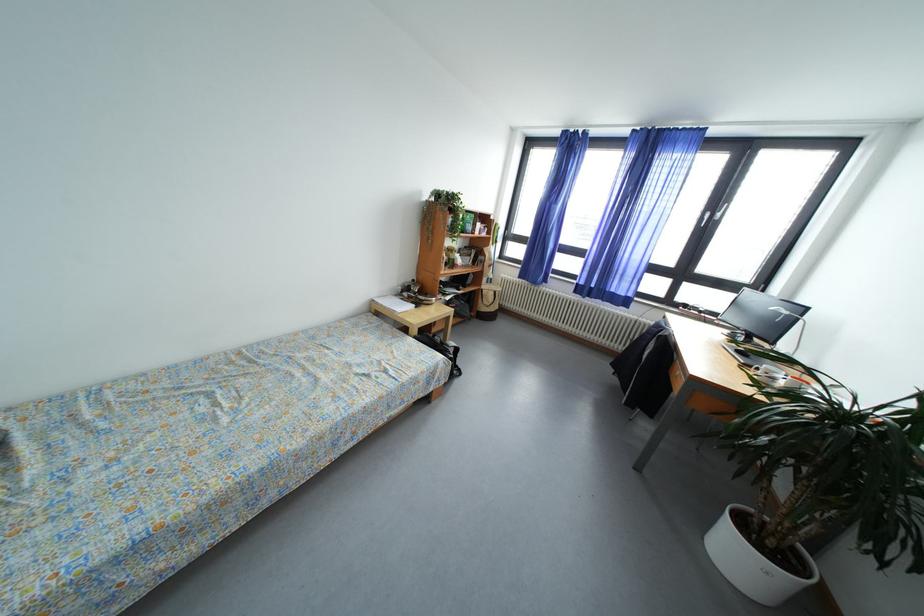
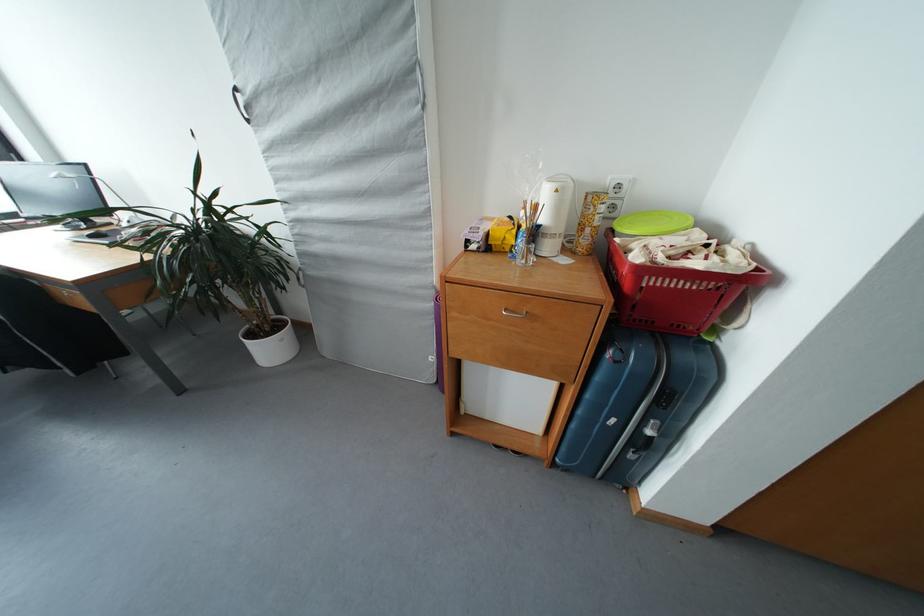
The first image is from the beginning of the video and the second image is from the end. How did the camera likely rotate when shooting the video?

The camera rotated toward right-down.